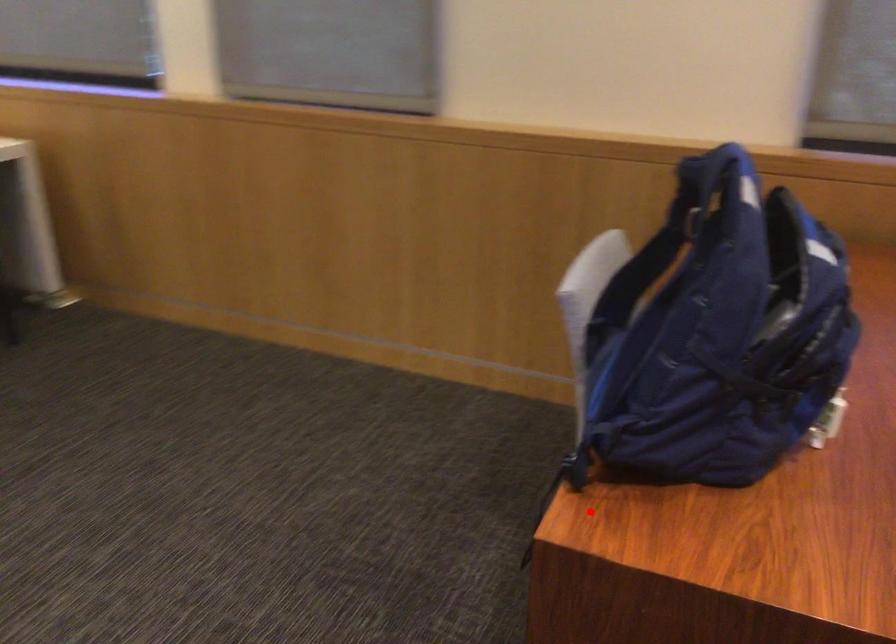
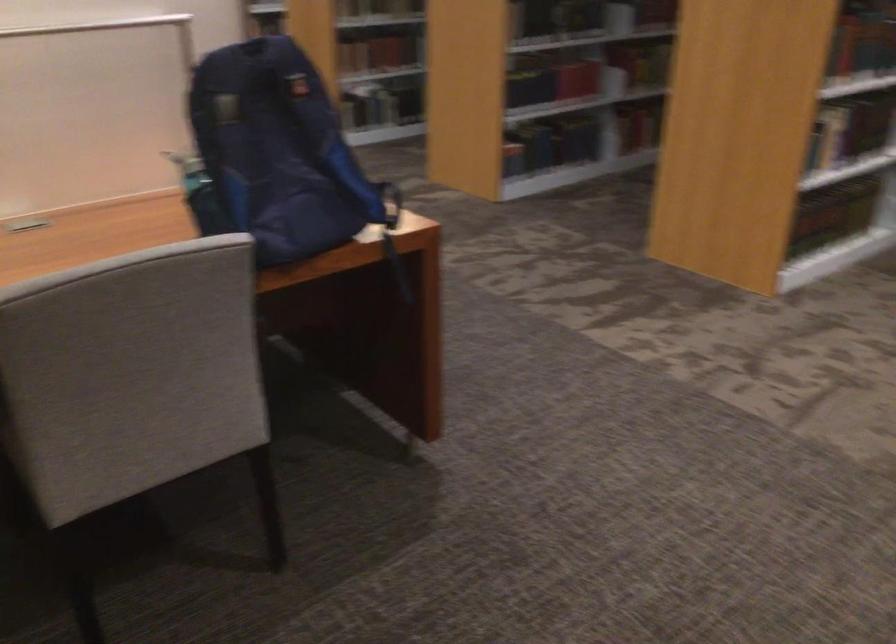
Question: I am providing you with two images of the same scene from different viewpoints. A red point is shown in image1. For the corresponding object point in image2, is it positioned nearer or farther from the camera?

Choices:
 (A) Nearer
 (B) Farther

Answer: (B)